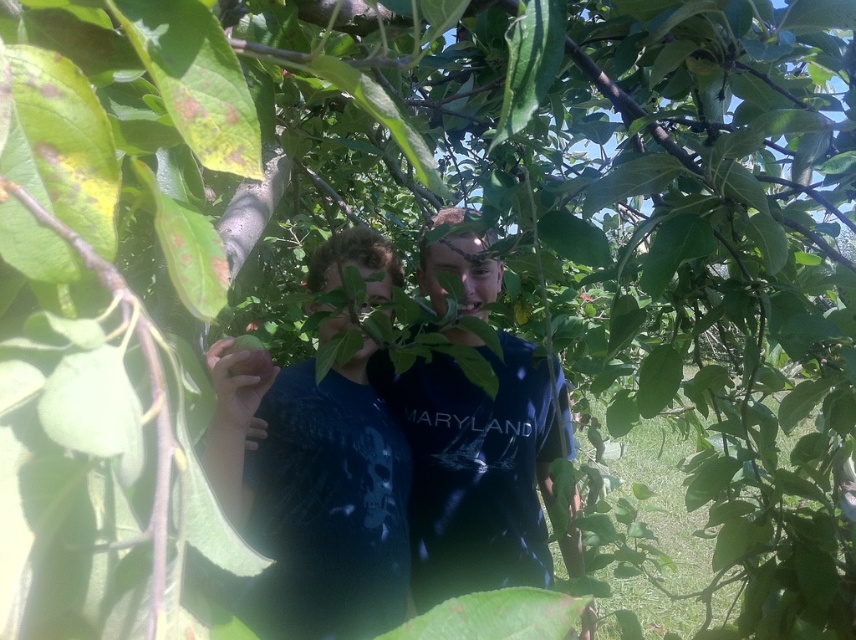
Question: In this image, where is matte blue t-shirt at center located relative to green matte apple at center?

Choices:
 (A) below
 (B) above

Answer: (A)

Question: Which object appears farthest from the camera in this image?

Choices:
 (A) matte blue t-shirt at center
 (B) green matte apple at center

Answer: (B)

Question: Can you confirm if matte blue t-shirt at center is positioned to the left of green matte apple at center?

Choices:
 (A) no
 (B) yes

Answer: (A)

Question: Among these objects, which one is nearest to the camera?

Choices:
 (A) green matte apple at center
 (B) matte blue t-shirt at center

Answer: (B)

Question: Does matte blue t-shirt at center have a smaller size compared to green matte apple at center?

Choices:
 (A) no
 (B) yes

Answer: (A)